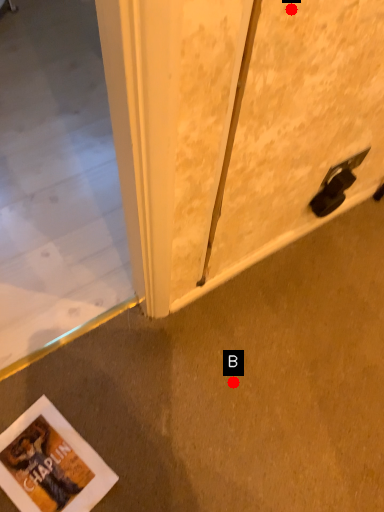
Question: Two points are circled on the image, labeled by A and B beside each circle. Which point appears closest to the camera in this image?

Choices:
 (A) A is closer
 (B) B is closer

Answer: (A)